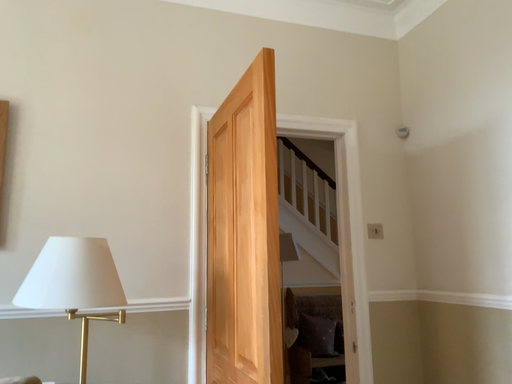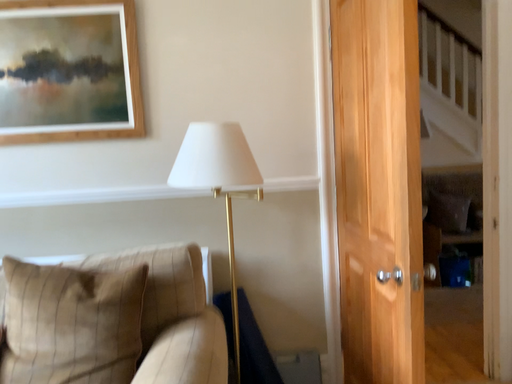
Question: Which way did the camera rotate in the video?

Choices:
 (A) rotated upward
 (B) rotated downward

Answer: (B)